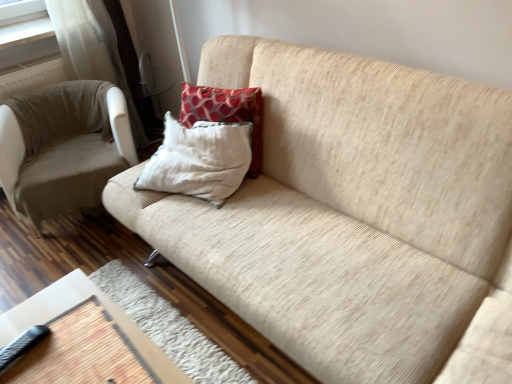
Question: Visually, is beige fabric couch at center positioned to the left or to the right of beige fabric chair at left?

Choices:
 (A) right
 (B) left

Answer: (A)

Question: Looking at the image, does beige fabric couch at center seem bigger or smaller compared to beige fabric chair at left?

Choices:
 (A) small
 (B) big

Answer: (B)

Question: Which of these objects is positioned closest to the black rubberized remote at lower left?

Choices:
 (A) wooden table at lower left
 (B) beige fabric chair at left
 (C) red textured pillow at upper center, acting as the second pillow starting from the front
 (D) beige fabric couch at center
 (E) red textured pillow at center, acting as the 1th pillow starting from the front

Answer: (A)

Question: Which object is positioned closest to the beige fabric couch at center?

Choices:
 (A) red textured pillow at upper center, acting as the second pillow starting from the front
 (B) beige fabric chair at left
 (C) wooden table at lower left
 (D) black rubberized remote at lower left
 (E) red textured pillow at center, acting as the 1th pillow starting from the front

Answer: (E)